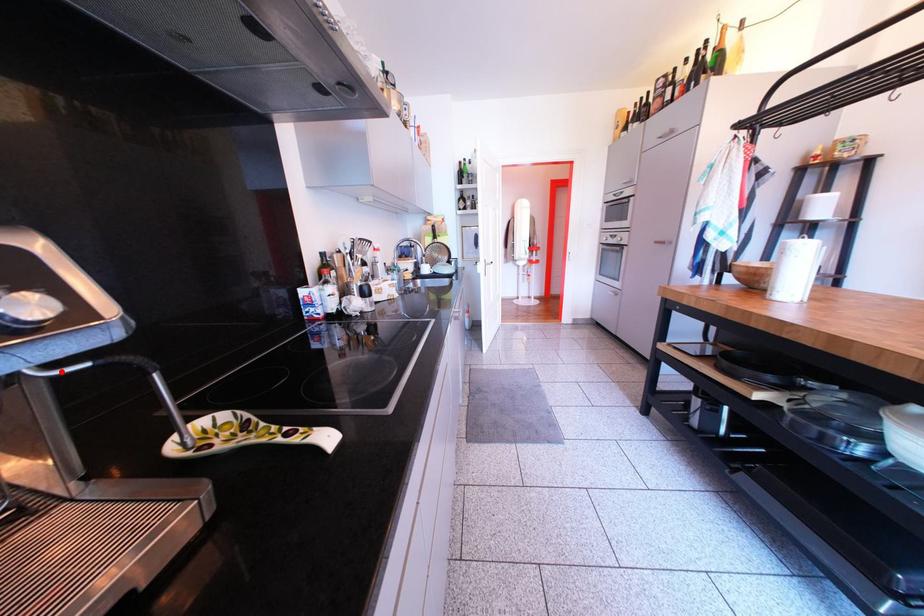
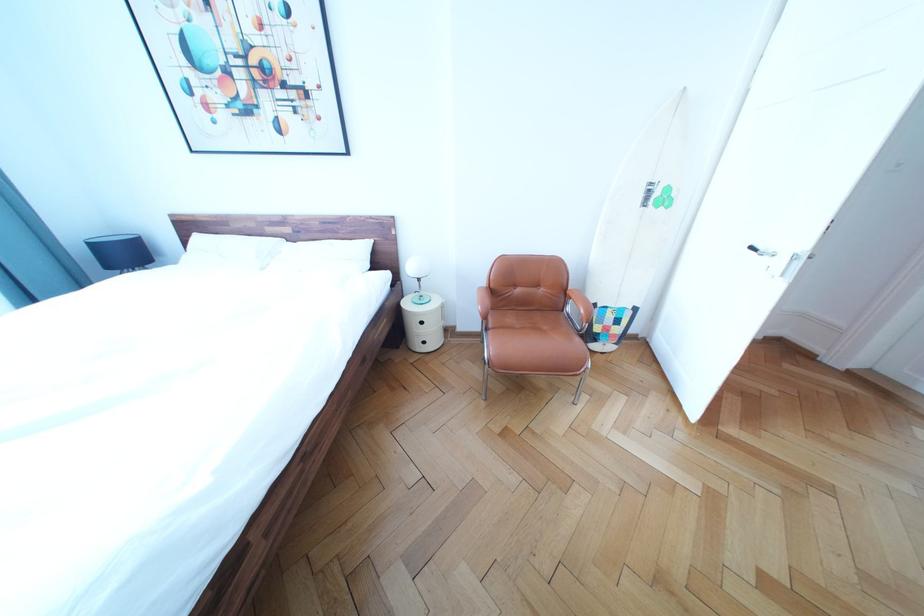
Question: I am providing you with two images of the same scene from different viewpoints. A red point is marked on the first image. Can you still see the location of the red point in image 2?

Choices:
 (A) Yes
 (B) No

Answer: (B)